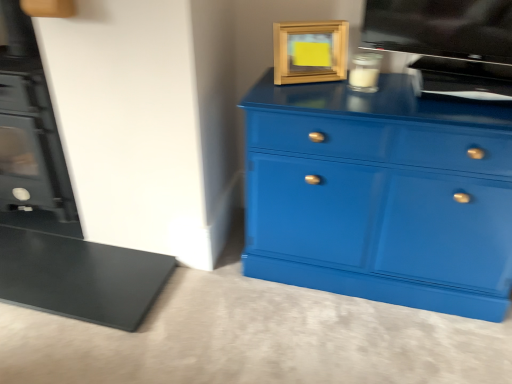
Locate an element on the screen. free location in front of wooden picture frame at upper center is located at coordinates (320, 100).